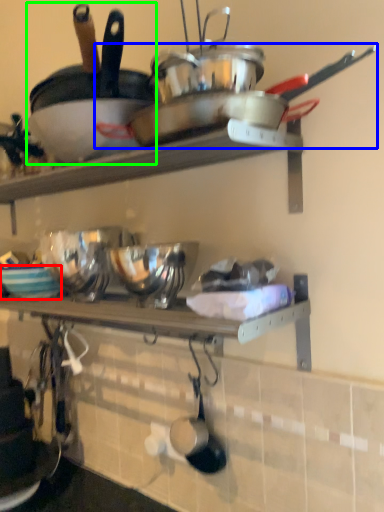
Question: Considering the real-world distances, which object is closest to bowl (highlighted by a red box)? wok (highlighted by a blue box) or frying pan (highlighted by a green box).

Choices:
 (A) wok
 (B) frying pan

Answer: (B)